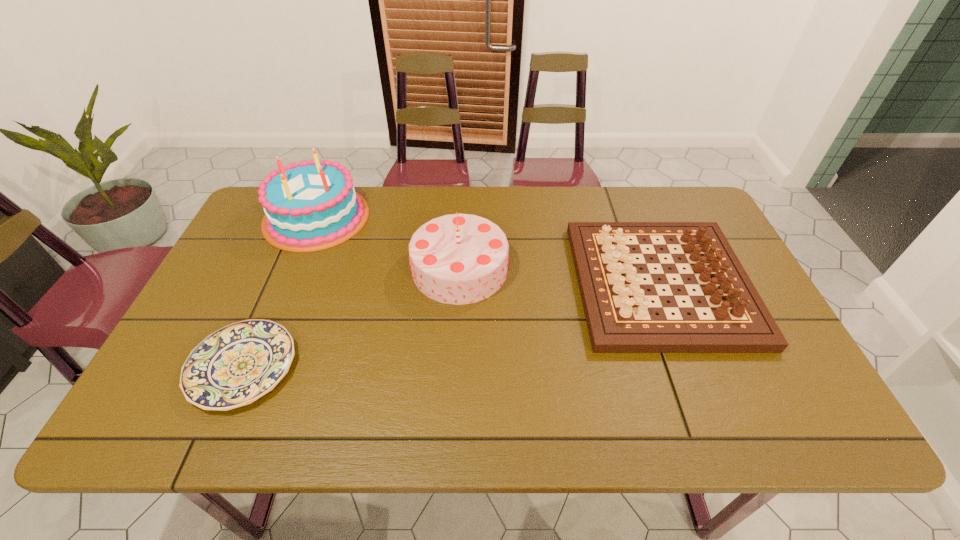
Locate an element on the screen. The image size is (960, 540). empty space that is in between the shortest object and the rightmost object is located at coordinates (451, 326).

Where is `free spot between the left birthday cake and the plate`? The height and width of the screenshot is (540, 960). free spot between the left birthday cake and the plate is located at coordinates (279, 292).

Find the location of a particular element. vacant space that's between the third object from left to right and the left birthday cake is located at coordinates (388, 243).

Identify the location of blank region between the second object from right to left and the gameboard. 560,276.

Identify the location of free space that is in between the rightmost object and the plate. (451, 326).

Find the location of a particular element. free spot between the left birthday cake and the plate is located at coordinates (279, 292).

Locate which object ranks third in proximity to the plate. Please provide its 2D coordinates. Your answer should be formatted as a tuple, i.e. [(x, y)], where the tuple contains the x and y coordinates of a point satisfying the conditions above.

[(621, 318)]

Locate which object is the second closest to the plate. Please provide its 2D coordinates. Your answer should be formatted as a tuple, i.e. [(x, y)], where the tuple contains the x and y coordinates of a point satisfying the conditions above.

[(309, 206)]

This screenshot has height=540, width=960. What are the coordinates of `free spot that satisfies the following two spatial constraints: 1. on the side with the white pieces of the gameboard; 2. on the front side of the shortest object` in the screenshot? It's located at (693, 367).

The image size is (960, 540). What are the coordinates of `free region that satisfies the following two spatial constraints: 1. on the front side of the second object from right to left; 2. on the left side of the left birthday cake` in the screenshot? It's located at (295, 268).